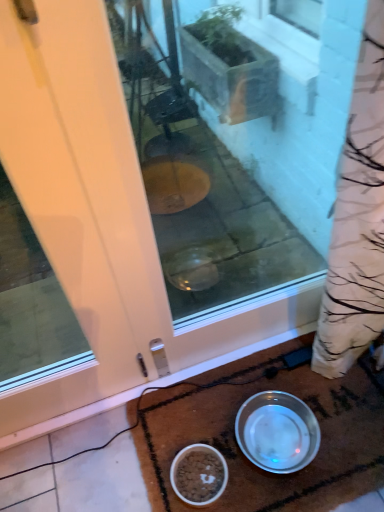
I want to click on free point to the right of silver metallic bowl at lower center, which ranks as the 2th bowl in left-to-right order, so click(x=342, y=426).